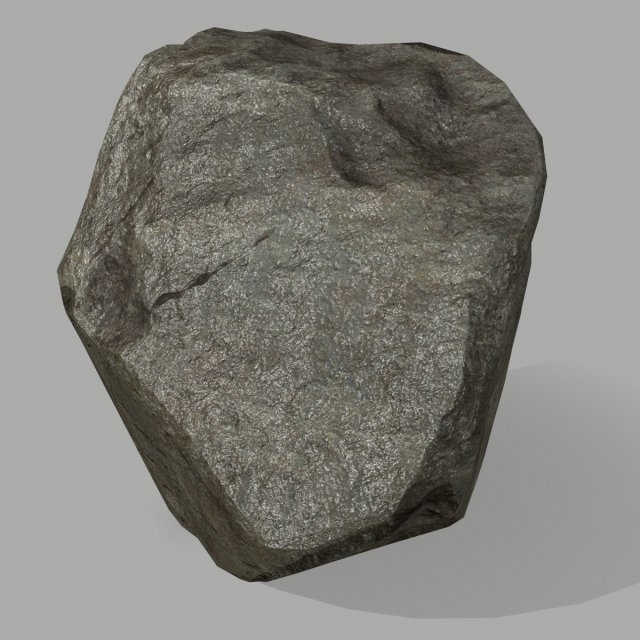
Where is `corner`? corner is located at coordinates (624, 627), (16, 625), (13, 27), (630, 11).